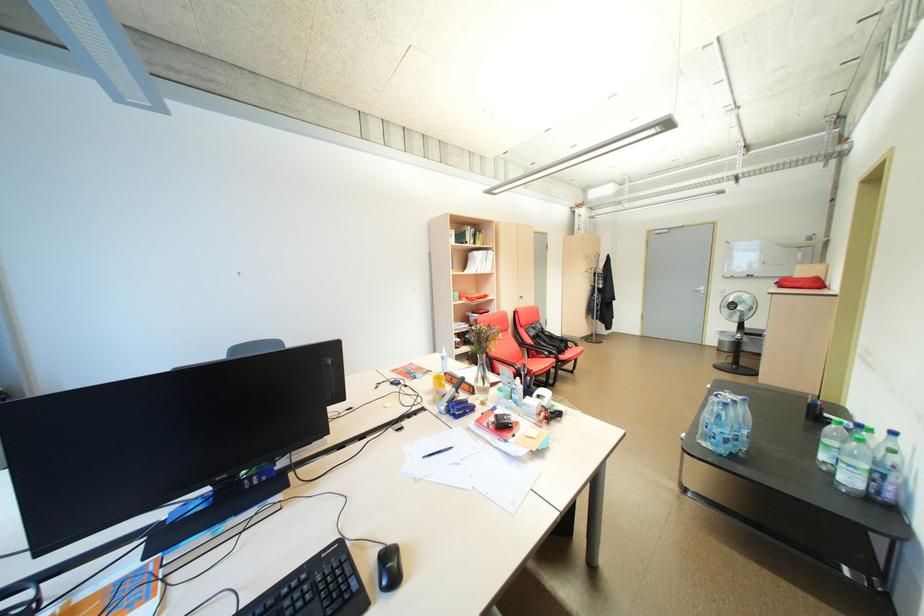
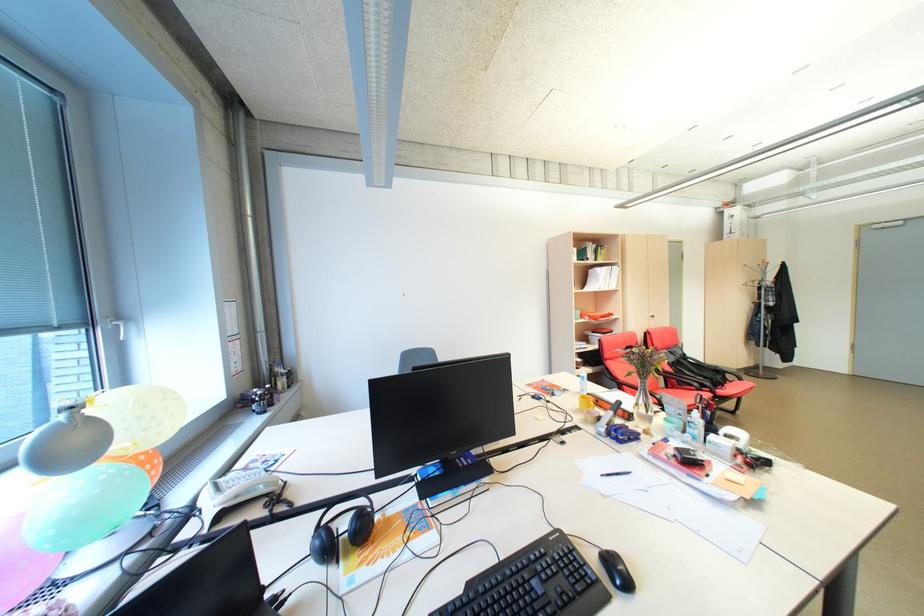
The point at [446,379] is marked in the first image. Where is the corresponding point in the second image?

(592, 399)